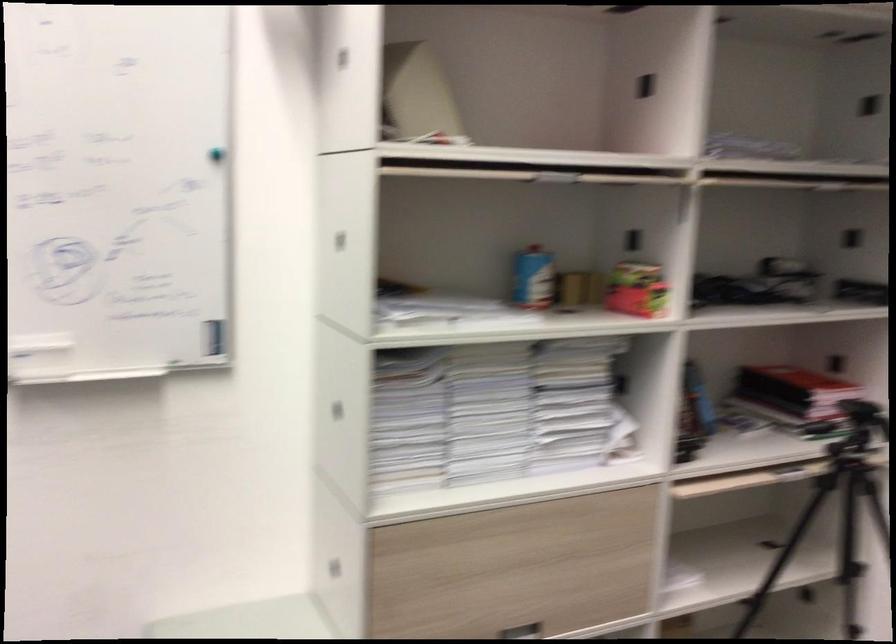
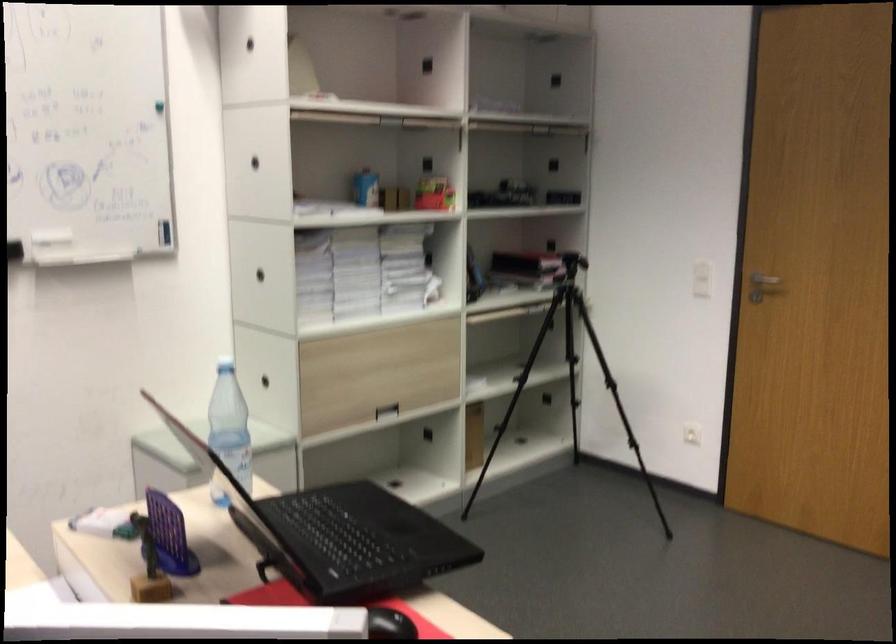
In a continuous first-person perspective shot, in which direction is the camera moving?

The cameraman moved toward left, backward.